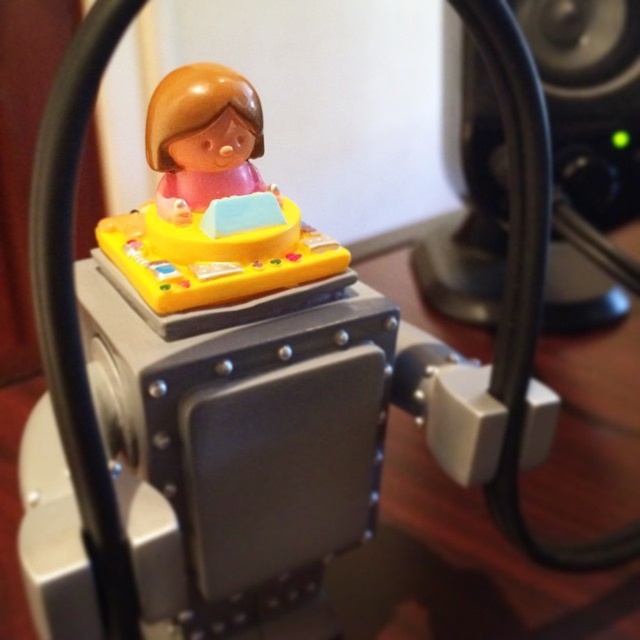
You are a small robot trying to navigate between two points in the image. The first point is point (484, 266) and the second point is point (192, 221). Which point is closer to you?

Point (484, 266) is further to the viewer than point (192, 221), so the closer point to you is point (192, 221).

You are positioning a new decorative item on the metallic base. The black plastic speaker at upper right is currently at coordinates 0.155, 0.922. Where should you place the new item to ensure it is directly to the left of the speaker?

Place the new item at coordinates approximately [589,35] to position it directly to the left of the black plastic speaker at upper right.